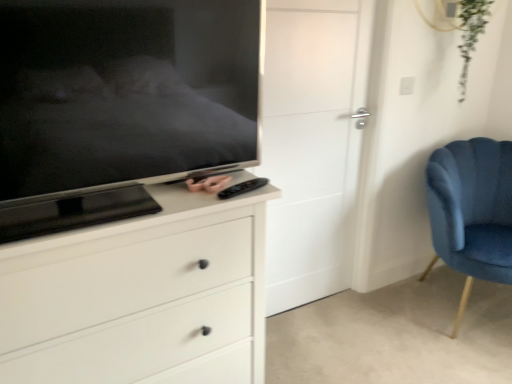
Question: Is white matte chest of drawers at center wider than velvet blue chair at right?

Choices:
 (A) no
 (B) yes

Answer: (A)

Question: Is white matte chest of drawers at center facing towards velvet blue chair at right?

Choices:
 (A) no
 (B) yes

Answer: (A)

Question: From a real-world perspective, does white matte chest of drawers at center stand above velvet blue chair at right?

Choices:
 (A) no
 (B) yes

Answer: (B)

Question: Can we say white matte chest of drawers at center lies outside velvet blue chair at right?

Choices:
 (A) yes
 (B) no

Answer: (A)

Question: From a real-world perspective, is white matte chest of drawers at center beneath velvet blue chair at right?

Choices:
 (A) yes
 (B) no

Answer: (B)

Question: From the image's perspective, relative to matte black tv at left, is velvet blue chair at right above or below?

Choices:
 (A) above
 (B) below

Answer: (B)

Question: Is velvet blue chair at right situated inside matte black tv at left or outside?

Choices:
 (A) inside
 (B) outside

Answer: (B)

Question: Considering the positions of velvet blue chair at right and matte black tv at left in the image, is velvet blue chair at right wider or thinner than matte black tv at left?

Choices:
 (A) wide
 (B) thin

Answer: (A)

Question: From a real-world perspective, is velvet blue chair at right above or below matte black tv at left?

Choices:
 (A) above
 (B) below

Answer: (B)

Question: Visually, is velvet blue chair at right positioned to the left or to the right of white matte chest of drawers at center?

Choices:
 (A) right
 (B) left

Answer: (A)

Question: Is velvet blue chair at right taller or shorter than white matte chest of drawers at center?

Choices:
 (A) tall
 (B) short

Answer: (B)

Question: Is velvet blue chair at right wider or thinner than white matte chest of drawers at center?

Choices:
 (A) wide
 (B) thin

Answer: (A)

Question: Which is correct: velvet blue chair at right is inside white matte chest of drawers at center, or outside of it?

Choices:
 (A) outside
 (B) inside

Answer: (A)

Question: Considering the positions of white matte chest of drawers at center and velvet blue chair at right in the image, is white matte chest of drawers at center wider or thinner than velvet blue chair at right?

Choices:
 (A) wide
 (B) thin

Answer: (B)

Question: Does point (45, 238) appear closer or farther from the camera than point (481, 157)?

Choices:
 (A) closer
 (B) farther

Answer: (A)